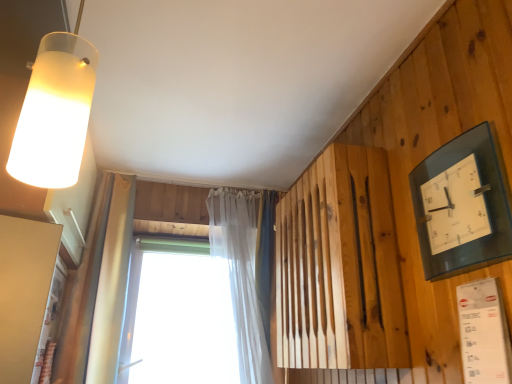
Locate an element on the screen. transparent glass clock at upper right is located at coordinates (462, 206).

Measure the distance between point (169, 240) and camera.

The distance of point (169, 240) from camera is 7.59 feet.

Where is `frosted glass lampshade at upper left`? The width and height of the screenshot is (512, 384). frosted glass lampshade at upper left is located at coordinates (55, 112).

Locate an element on the screen. The image size is (512, 384). translucent fabric curtain at upper center is located at coordinates (244, 274).

Is frosted glass lampshade at upper left smaller than transparent glass clock at upper right?

Indeed, frosted glass lampshade at upper left has a smaller size compared to transparent glass clock at upper right.

Is frosted glass lampshade at upper left to the left or to the right of transparent glass clock at upper right in the image?

Clearly, frosted glass lampshade at upper left is on the left of transparent glass clock at upper right in the image.

The height and width of the screenshot is (384, 512). Find the location of `lamp above the transparent glass clock at upper right (from a real-world perspective)`. lamp above the transparent glass clock at upper right (from a real-world perspective) is located at coordinates (55, 112).

Who is bigger, frosted glass lampshade at upper left or transparent plastic window at center?

transparent plastic window at center is bigger.

Is frosted glass lampshade at upper left oriented towards transparent plastic window at center?

No, frosted glass lampshade at upper left is not turned towards transparent plastic window at center.

Is frosted glass lampshade at upper left touching transparent plastic window at center?

There is a gap between frosted glass lampshade at upper left and transparent plastic window at center.

Does frosted glass lampshade at upper left appear on the right side of transparent plastic window at center?

Correct, you'll find frosted glass lampshade at upper left to the right of transparent plastic window at center.

Is transparent glass clock at upper right to the left of transparent plastic window at center from the viewer's perspective?

Incorrect, transparent glass clock at upper right is not on the left side of transparent plastic window at center.

Considering the sizes of objects transparent glass clock at upper right and transparent plastic window at center in the image provided, who is taller, transparent glass clock at upper right or transparent plastic window at center?

Standing taller between the two is transparent plastic window at center.

Between transparent glass clock at upper right and transparent plastic window at center, which one has larger size?

transparent plastic window at center.

Consider the image. What's the angular difference between transparent glass clock at upper right and transparent plastic window at center's facing directions?

88.9 degrees separate the facing orientations of transparent glass clock at upper right and transparent plastic window at center.

Which point is more distant from viewer, [264,201] or [441,173]?

The point [264,201] is behind.

Considering the sizes of objects translucent fabric curtain at upper center and transparent glass clock at upper right in the image provided, who is bigger, translucent fabric curtain at upper center or transparent glass clock at upper right?

translucent fabric curtain at upper center.

Is the depth of translucent fabric curtain at upper center greater than that of transparent glass clock at upper right?

Yes, translucent fabric curtain at upper center is further from the viewer.

Which object is thinner, transparent glass clock at upper right or frosted glass lampshade at upper left?

transparent glass clock at upper right.

Looking at this image, which is behind, transparent glass clock at upper right or frosted glass lampshade at upper left?

transparent glass clock at upper right is more distant.

In the image, there is a transparent glass clock at upper right. Where is `lamp above it (from the image's perspective)`? Image resolution: width=512 pixels, height=384 pixels. lamp above it (from the image's perspective) is located at coordinates (55, 112).

Considering the relative positions of transparent glass clock at upper right and frosted glass lampshade at upper left in the image provided, is transparent glass clock at upper right to the left of frosted glass lampshade at upper left from the viewer's perspective?

No.

Is frosted glass lampshade at upper left touching translucent fabric curtain at upper center?

No, frosted glass lampshade at upper left is not with translucent fabric curtain at upper center.

From a real-world perspective, does frosted glass lampshade at upper left sit lower than translucent fabric curtain at upper center?

Actually, frosted glass lampshade at upper left is physically above translucent fabric curtain at upper center in the real world.

From the image's perspective, which one is positioned higher, frosted glass lampshade at upper left or translucent fabric curtain at upper center?

frosted glass lampshade at upper left appears higher in the image.

Do you think frosted glass lampshade at upper left is within translucent fabric curtain at upper center, or outside of it?

frosted glass lampshade at upper left cannot be found inside translucent fabric curtain at upper center.

Looking at this image, is transparent glass clock at upper right bigger or smaller than translucent fabric curtain at upper center?

transparent glass clock at upper right is smaller than translucent fabric curtain at upper center.

From a real-world perspective, is transparent glass clock at upper right positioned under translucent fabric curtain at upper center based on gravity?

Yes, from a real-world perspective, transparent glass clock at upper right is below translucent fabric curtain at upper center.

Between transparent glass clock at upper right and translucent fabric curtain at upper center, which one appears on the left side from the viewer's perspective?

translucent fabric curtain at upper center is more to the left.

Is point (480, 157) in front of point (254, 224)?

Yes.

Find the location of a particular element. This screenshot has width=512, height=384. clock located underneath the frosted glass lampshade at upper left (from a real-world perspective) is located at coordinates (462, 206).

The width and height of the screenshot is (512, 384). Identify the location of window on the left of frosted glass lampshade at upper left. (178, 316).

Based on their spatial positions, is translucent fabric curtain at upper center or transparent plastic window at center closer to frosted glass lampshade at upper left?

translucent fabric curtain at upper center is closer to frosted glass lampshade at upper left.

Based on the photo, estimate the real-world distances between objects in this image. Which object is closer to transparent plastic window at center, translucent fabric curtain at upper center or frosted glass lampshade at upper left?

The object closer to transparent plastic window at center is translucent fabric curtain at upper center.

From the image, which object appears to be nearer to transparent glass clock at upper right, translucent fabric curtain at upper center or transparent plastic window at center?

translucent fabric curtain at upper center is closer to transparent glass clock at upper right.

Considering their positions, is transparent plastic window at center positioned further to frosted glass lampshade at upper left than transparent glass clock at upper right?

transparent plastic window at center is further to frosted glass lampshade at upper left.

Looking at the image, which one is located closer to transparent plastic window at center, frosted glass lampshade at upper left or transparent glass clock at upper right?

Among the two, transparent glass clock at upper right is located nearer to transparent plastic window at center.

Based on the photo, from the image, which object appears to be farther from translucent fabric curtain at upper center, transparent glass clock at upper right or frosted glass lampshade at upper left?

frosted glass lampshade at upper left is further to translucent fabric curtain at upper center.

Looking at this image, based on their spatial positions, is frosted glass lampshade at upper left or transparent plastic window at center closer to translucent fabric curtain at upper center?

transparent plastic window at center is closer to translucent fabric curtain at upper center.

Which object lies nearer to the anchor point transparent plastic window at center, transparent glass clock at upper right or translucent fabric curtain at upper center?

Based on the image, translucent fabric curtain at upper center appears to be nearer to transparent plastic window at center.

Where is `clock between frosted glass lampshade at upper left and translucent fabric curtain at upper center from front to back`? The width and height of the screenshot is (512, 384). clock between frosted glass lampshade at upper left and translucent fabric curtain at upper center from front to back is located at coordinates (462, 206).

The height and width of the screenshot is (384, 512). Identify the location of clock between frosted glass lampshade at upper left and transparent plastic window at center along the z-axis. (462, 206).

Where is `curtain located between transparent glass clock at upper right and transparent plastic window at center in the depth direction`? curtain located between transparent glass clock at upper right and transparent plastic window at center in the depth direction is located at coordinates (244, 274).

Find the location of a particular element. Image resolution: width=512 pixels, height=384 pixels. curtain between frosted glass lampshade at upper left and transparent plastic window at center in the front-back direction is located at coordinates (244, 274).